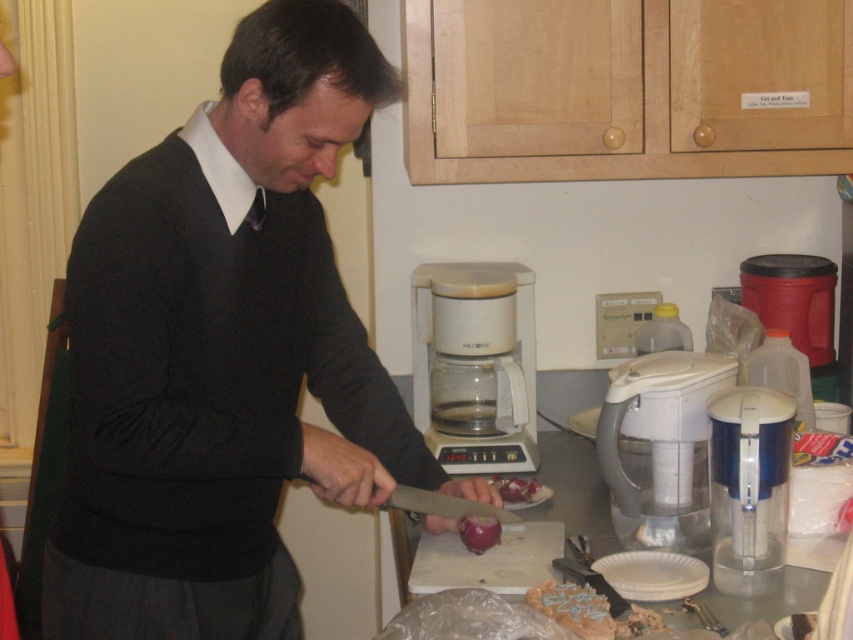
Does white plastic cutting board at center appear under red translucent onion at lower center?

Indeed, white plastic cutting board at center is positioned under red translucent onion at lower center.

Can you confirm if white plastic cutting board at center is positioned to the left of red translucent onion at lower center?

Correct, you'll find white plastic cutting board at center to the left of red translucent onion at lower center.

Which is behind, point (508, 556) or point (534, 490)?

Point (534, 490)

Locate an element on the screen. The width and height of the screenshot is (853, 640). white plastic cutting board at center is located at coordinates (488, 561).

Which is behind, point (288, 56) or point (509, 502)?

Positioned behind is point (509, 502).

Which is behind, point (225, 252) or point (514, 488)?

Positioned behind is point (514, 488).

Find the location of a particular element. The height and width of the screenshot is (640, 853). matte black sweater at center is located at coordinates (223, 353).

Is matte black sweater at center positioned in front of red smooth onion at lower center?

Yes.

Which is above, matte black sweater at center or red smooth onion at lower center?

Positioned higher is matte black sweater at center.

Is point (369, 451) positioned after point (486, 545)?

Yes, point (369, 451) is behind point (486, 545).

Find the location of a particular element. matte black sweater at center is located at coordinates (223, 353).